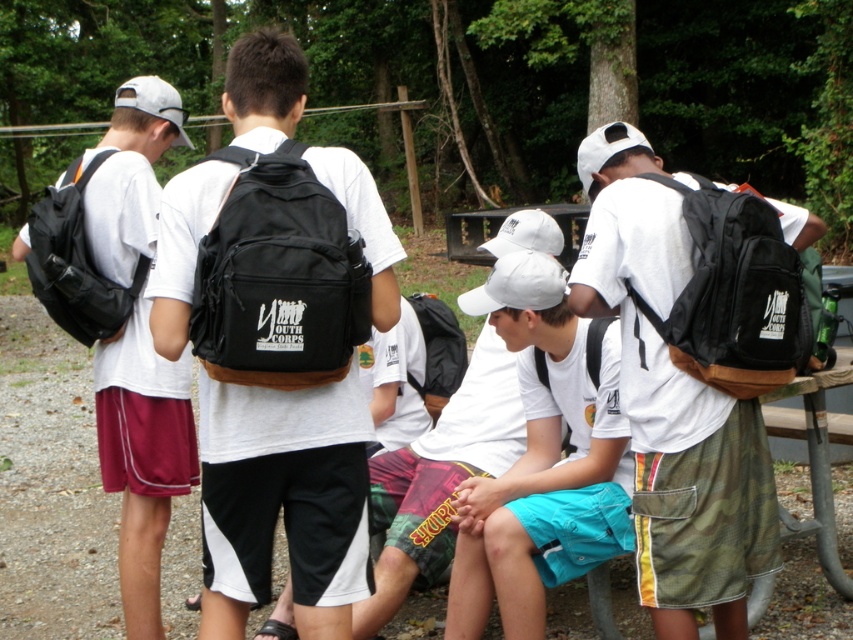
Question: Can you confirm if white matte cap at center is smaller than black matte backpack at center?

Choices:
 (A) yes
 (B) no

Answer: (B)

Question: Considering the real-world distances, which object is closest to the black matte backpack at center?

Choices:
 (A) black fabric backpack at back
 (B) matte black backpack at left

Answer: (A)

Question: Considering the relative positions of black matte backpack at center and black fabric backpack at back in the image provided, where is black matte backpack at center located with respect to black fabric backpack at back?

Choices:
 (A) below
 (B) above

Answer: (B)

Question: Which of the following is the farthest from the observer?

Choices:
 (A) (100, 424)
 (B) (683, 364)
 (C) (572, 305)

Answer: (A)

Question: Which point is farther to the camera?

Choices:
 (A) black fabric backpack at right
 (B) black fabric backpack at center

Answer: (A)

Question: Can you confirm if black matte backpack at center is wider than black fabric backpack at back?

Choices:
 (A) yes
 (B) no

Answer: (A)